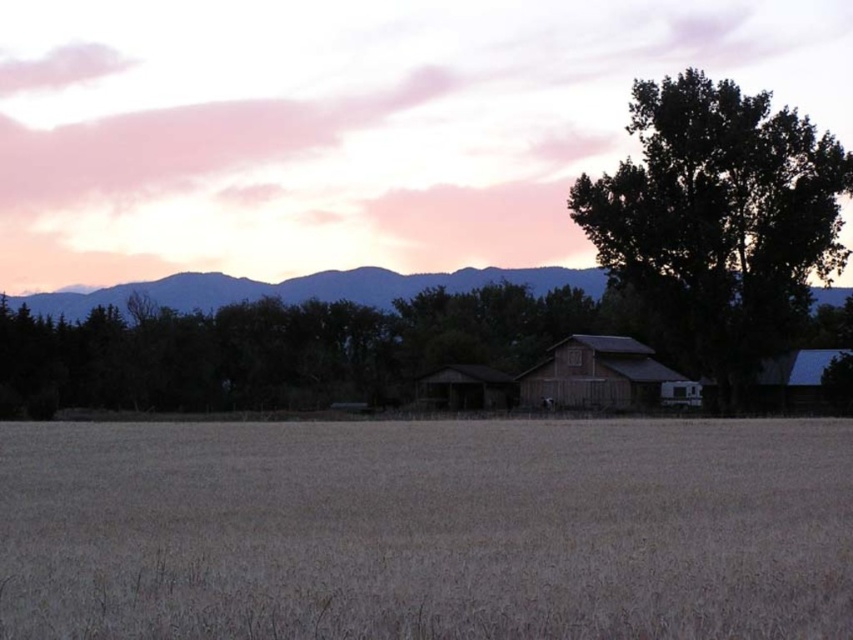
You are standing in the field of golden grass looking towards the horizon. There are two points marked in the scene. The first point is at coordinate (750,333) and the second point is at coordinate (544,358). Which point is closer to your current position?

Point (750,333) is closer to the camera than point (544,358), so the first point is closer to your current position.

You are a photographer planning to capture a landscape photo that includes both the dark green leafy tree at center and the wooden barn at center. Considering their heights, which object will appear larger in the photo?

The dark green leafy tree at center is much taller than the wooden barn at center, so it will appear larger in the photo.